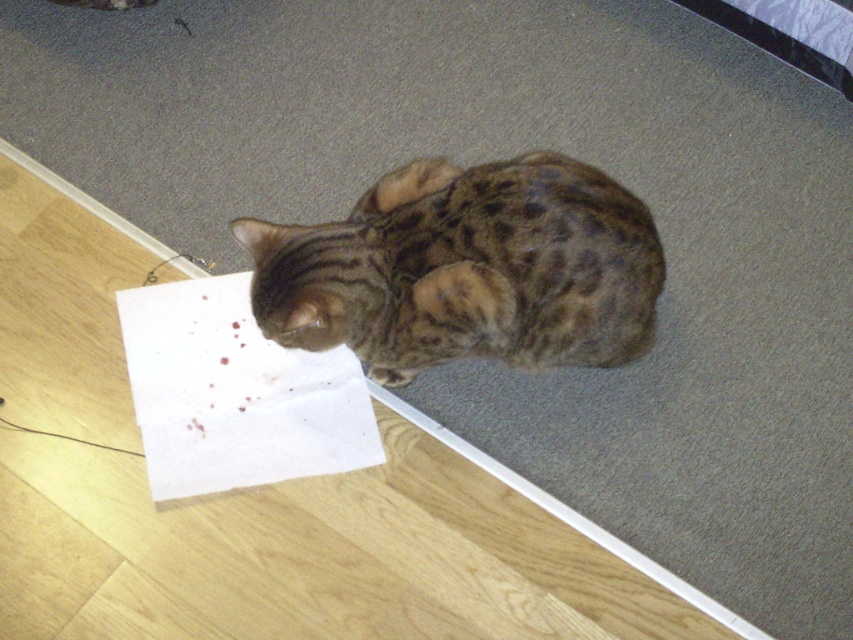
You are a cat owner who wants to place a new mat between the spotted fur cat at center and the white paper at lower left. Given that the mat must be narrower than both objects, can you confirm if this is possible?

The spotted fur cat at center is wider than the white paper at lower left. Since the mat must be narrower than both, the maximum width the mat can be is the width of the narrower object, which is the white paper at lower left. Therefore, it is possible to place a mat narrower than both as long as it is smaller than the white paper at lower left.

You are a pet sitter who needs to pick up the white paper at lower left without disturbing the spotted fur cat at center. Based on their positions, which direction should you approach from?

The spotted fur cat at center is on the right side of the white paper at lower left, so you should approach from the left side to avoid disturbing the cat.